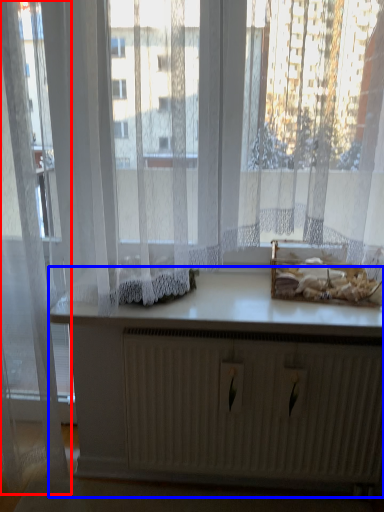
Question: Which of the following is the farthest to the observer, curtain (highlighted by a red box) or vanity (highlighted by a blue box)?

Choices:
 (A) curtain
 (B) vanity

Answer: (B)